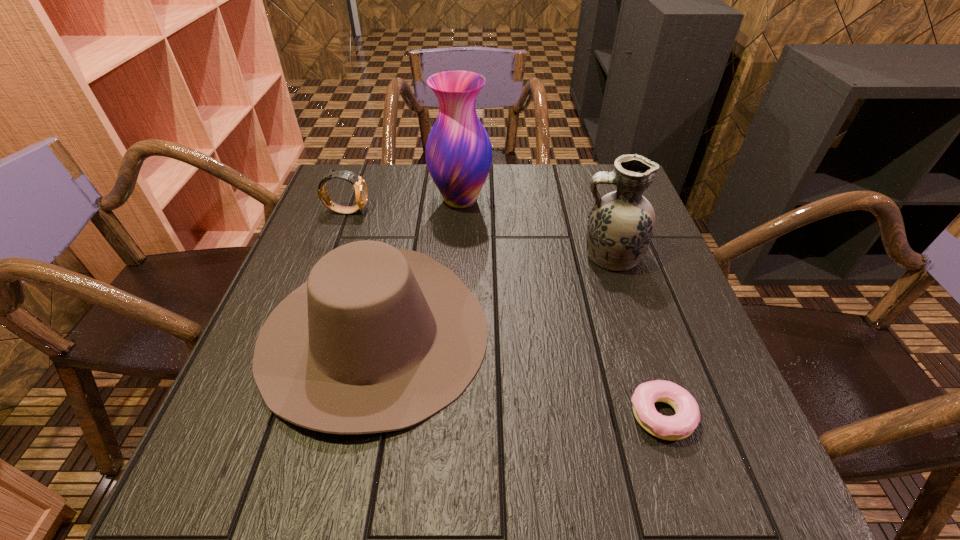
You are a GUI agent. You are given a task and a screenshot of the screen. Output one action in this format:
    pyautogui.click(x=<x>, y=<y>)
    Task: Click on the object located at the far left corner
    The width and height of the screenshot is (960, 540).
    Given the screenshot: What is the action you would take?
    pyautogui.click(x=361, y=193)

The image size is (960, 540). What are the coordinates of `vacant space at the far edge of the desktop` in the screenshot? It's located at (505, 194).

Identify the location of free region at the near edge of the desktop. (523, 494).

Find the location of a particular element. This screenshot has height=540, width=960. free space at the left edge of the desktop is located at coordinates [284, 440].

What are the coordinates of `free space at the right edge` in the screenshot? It's located at (647, 280).

At what (x,y) coordinates should I click in order to perform the action: click on vacant space at the far left corner of the desktop. Please return your answer as a coordinate pair (x, y). Looking at the image, I should click on (348, 198).

Identify the location of vacant area at the near right corner. The width and height of the screenshot is (960, 540). (716, 508).

The image size is (960, 540). In order to click on free space between the right vase and the farther vase in this screenshot , I will do `click(535, 228)`.

Where is `vacant region between the cowboy hat and the shortest object`? The height and width of the screenshot is (540, 960). vacant region between the cowboy hat and the shortest object is located at coordinates (517, 374).

Locate an element on the screen. This screenshot has height=540, width=960. vacant point located between the cowboy hat and the shorter vase is located at coordinates (492, 295).